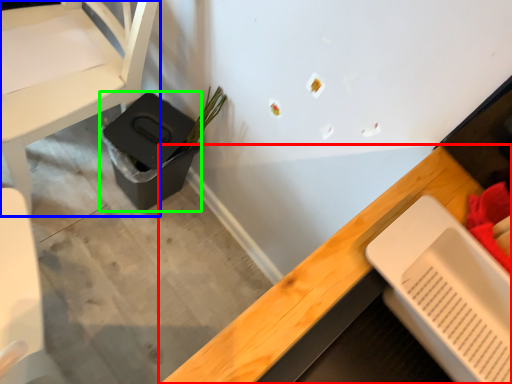
Question: Based on their relative distances, which object is farther from desk (highlighted by a red box)? Choose from chair (highlighted by a blue box) and potty (highlighted by a green box).

Choices:
 (A) chair
 (B) potty

Answer: (A)